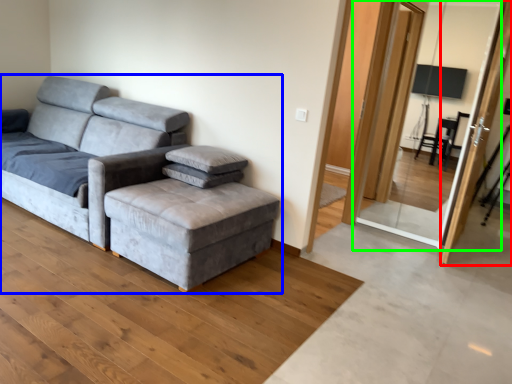
Question: Based on their relative distances, which object is farther from screen door (highlighted by a red box)? Choose from studio couch (highlighted by a blue box) and screen door (highlighted by a green box).

Choices:
 (A) studio couch
 (B) screen door

Answer: (B)